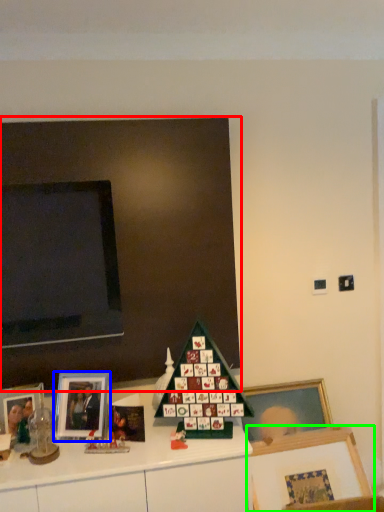
Question: Which is nearer to the bulletin board (highlighted by a red box)? picture frame (highlighted by a blue box) or picture frame (highlighted by a green box).

Choices:
 (A) picture frame
 (B) picture frame

Answer: (A)